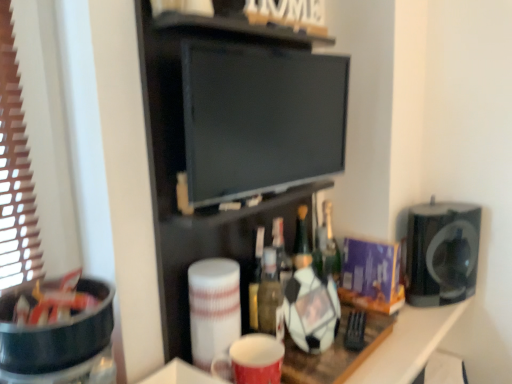
This screenshot has height=384, width=512. Identify the location of black matte tv at center. (184, 167).

Measure the distance between point (309, 375) and camera.

Point (309, 375) and camera are 38.15 inches apart.

Image resolution: width=512 pixels, height=384 pixels. What do you see at coordinates (59, 336) in the screenshot? I see `black plastic bowl at left, which is the second appliance in right-to-left order` at bounding box center [59, 336].

This screenshot has width=512, height=384. What do you see at coordinates (442, 253) in the screenshot?
I see `black matte speaker at right, acting as the 2th appliance starting from the front` at bounding box center [442, 253].

Locate an element on the screen. Image resolution: width=512 pixels, height=384 pixels. black matte tv at center is located at coordinates (184, 167).

Considering the relative sizes of translucent glass bottle at center and black glossy flat screen tv at center in the image provided, is translucent glass bottle at center thinner than black glossy flat screen tv at center?

No.

Does translucent glass bottle at center contain black glossy flat screen tv at center?

No, black glossy flat screen tv at center is not a part of translucent glass bottle at center.

Which object is wider, black matte tv at center or matte red mug at center?

black matte tv at center.

Is black matte tv at center outside of matte red mug at center?

Yes.

Looking at this image, from the image's perspective, which one is positioned higher, black matte tv at center or matte red mug at center?

black matte tv at center appears higher in the image.

Is matte red mug at center closer to camera compared to translucent glass bottle at center?

Yes, the depth of matte red mug at center is less than that of translucent glass bottle at center.

Is matte red mug at center looking in the opposite direction of translucent glass bottle at center?

matte red mug at center is not turned away from translucent glass bottle at center.

From the picture: What's the angular difference between matte red mug at center and translucent glass bottle at center's facing directions?

0.00193 degrees separate the facing orientations of matte red mug at center and translucent glass bottle at center.

Between matte red mug at center and translucent glass bottle at center, which one has larger width?

matte red mug at center.

Is black matte tv at center oriented away from translucent glass bottle at center?

No, black matte tv at center is not facing away from translucent glass bottle at center.

Is point (154, 204) positioned after point (339, 275)?

No, it is not.

Between black matte tv at center and translucent glass bottle at center, which one appears on the left side from the viewer's perspective?

From the viewer's perspective, black matte tv at center appears more on the left side.

How far apart are black matte tv at center and translucent glass bottle at center?

black matte tv at center is 13.79 inches from translucent glass bottle at center.

Is black matte tv at center oriented away from black plastic bowl at left, arranged as the 1th appliance when viewed from the left?

black matte tv at center is not turned away from black plastic bowl at left, arranged as the 1th appliance when viewed from the left.

Is the surface of black matte tv at center in direct contact with black plastic bowl at left, arranged as the 1th appliance when viewed from the left?

black matte tv at center is not next to black plastic bowl at left, arranged as the 1th appliance when viewed from the left, and they're not touching.

Is black plastic bowl at left, the second appliance in the back-to-front sequence, surrounded by black matte tv at center?

No, black matte tv at center does not contain black plastic bowl at left, the second appliance in the back-to-front sequence.

How distant is black matte tv at center from black plastic bowl at left, which is the second appliance in right-to-left order?

They are 12.60 inches apart.

From the image's perspective, is translucent glass bottle at center above black matte speaker at right, acting as the 2th appliance starting from the front?

Yes, from the image's perspective, translucent glass bottle at center is above black matte speaker at right, acting as the 2th appliance starting from the front.

Is black matte speaker at right, the 2th appliance positioned from the left, a part of translucent glass bottle at center?

Actually, black matte speaker at right, the 2th appliance positioned from the left, is outside translucent glass bottle at center.

Who is taller, translucent glass bottle at center or black matte speaker at right, the 2th appliance positioned from the left?

Standing taller between the two is black matte speaker at right, the 2th appliance positioned from the left.

Which of these two, translucent glass bottle at center or black matte speaker at right, acting as the 2th appliance starting from the front, is smaller?

translucent glass bottle at center is smaller.

From the image's perspective, starting from the matte red mug at center, which appliance is the 2nd one above? Please provide its 2D coordinates.

[(442, 253)]

Looking at this image, is black matte speaker at right, the 2th appliance positioned from the left, facing away from matte red mug at center?

No, black matte speaker at right, the 2th appliance positioned from the left,'s orientation is not away from matte red mug at center.

Would you say black matte speaker at right, acting as the 2th appliance starting from the front, is outside matte red mug at center?

Yes, black matte speaker at right, acting as the 2th appliance starting from the front, is outside of matte red mug at center.

From the image's perspective, which is above, black matte speaker at right, placed as the first appliance when sorted from back to front, or matte red mug at center?

black matte speaker at right, placed as the first appliance when sorted from back to front.

Where is `flat lying above the translucent glass bottle at center (from the image's perspective)`? This screenshot has width=512, height=384. flat lying above the translucent glass bottle at center (from the image's perspective) is located at coordinates (260, 119).

At what (x,y) coordinates should I click in order to perform the action: click on mug that appears below the black matte tv at center (from a real-world perspective). Please return your answer as a coordinate pair (x, y). This screenshot has width=512, height=384. Looking at the image, I should click on (251, 360).

Based on the photo, which object lies further to the anchor point black plastic bowl at left, which is the second appliance in right-to-left order, matte red mug at center or black matte tv at center?

The object further to black plastic bowl at left, which is the second appliance in right-to-left order, is matte red mug at center.

In the scene shown: Based on their spatial positions, is black plastic bowl at left, which is the first appliance from front to back, or black matte speaker at right, acting as the 2th appliance starting from the front, further from translucent glass bottle at center?

black plastic bowl at left, which is the first appliance from front to back, is further to translucent glass bottle at center.

Estimate the real-world distances between objects in this image. Which object is closer to black glossy flat screen tv at center, translucent glass bottle at center or black matte speaker at right, acting as the 2th appliance starting from the front?

translucent glass bottle at center.

Estimate the real-world distances between objects in this image. Which object is closer to black glossy flat screen tv at center, matte red mug at center or black matte tv at center?

black matte tv at center is positioned closer to the anchor black glossy flat screen tv at center.

Estimate the real-world distances between objects in this image. Which object is further from black glossy flat screen tv at center, translucent glass bottle at center or black plastic bowl at left, which is the first appliance from front to back?

black plastic bowl at left, which is the first appliance from front to back.

Estimate the real-world distances between objects in this image. Which object is closer to black glossy flat screen tv at center, matte red mug at center or black matte speaker at right, the 2th appliance positioned from the left?

Based on the image, matte red mug at center appears to be nearer to black glossy flat screen tv at center.

Looking at the image, which one is located further to matte red mug at center, black glossy flat screen tv at center or black matte tv at center?

The object further to matte red mug at center is black glossy flat screen tv at center.

Estimate the real-world distances between objects in this image. Which object is further from translucent glass bottle at center, matte red mug at center or black matte speaker at right, acting as the 2th appliance starting from the front?

Among the two, matte red mug at center is located further to translucent glass bottle at center.

You are a GUI agent. You are given a task and a screenshot of the screen. Output one action in this format:
    pyautogui.click(x=<x>, y=<y>)
    Task: Click on the entertainment center between black plastic bowl at left, arranged as the 1th appliance when viewed from the left, and translucent glass bottle at center from front to back
    Image resolution: width=512 pixels, height=384 pixels.
    Given the screenshot: What is the action you would take?
    pyautogui.click(x=184, y=167)

This screenshot has width=512, height=384. In order to click on appliance positioned between black glossy flat screen tv at center and translucent glass bottle at center from near to far in this screenshot , I will do `click(442, 253)`.

The width and height of the screenshot is (512, 384). Find the location of `entertainment center between black plastic bowl at left, the second appliance in the back-to-front sequence, and black glossy flat screen tv at center`. entertainment center between black plastic bowl at left, the second appliance in the back-to-front sequence, and black glossy flat screen tv at center is located at coordinates [184, 167].

This screenshot has width=512, height=384. Find the location of `flat between black matte tv at center and black matte speaker at right, the 2th appliance positioned from the left`. flat between black matte tv at center and black matte speaker at right, the 2th appliance positioned from the left is located at coordinates (260, 119).